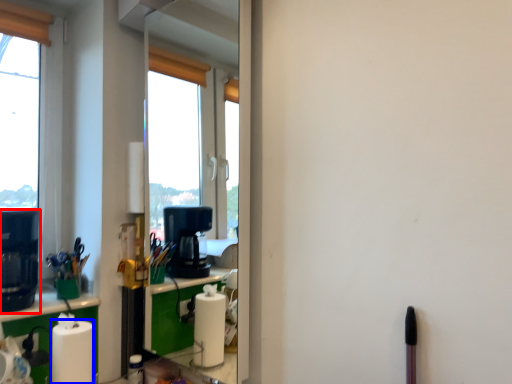
Question: Which object appears closest to the camera in this image, coffee machine (highlighted by a red box) or paper towel (highlighted by a blue box)?

Choices:
 (A) coffee machine
 (B) paper towel

Answer: (B)